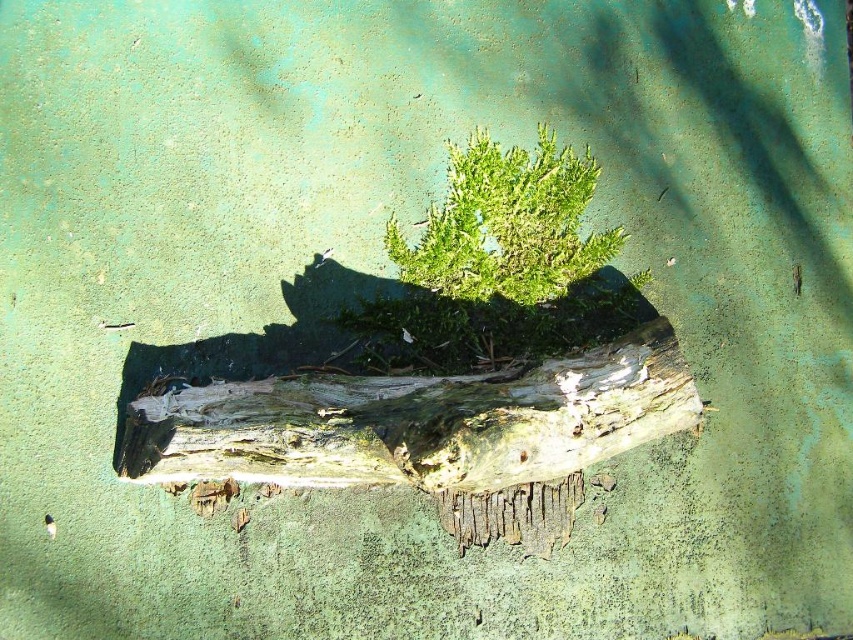
Question: Does weathered wood log at center appear over green fuzzy fern at center?

Choices:
 (A) yes
 (B) no

Answer: (B)

Question: Does weathered wood log at center have a lesser width compared to green fuzzy fern at center?

Choices:
 (A) no
 (B) yes

Answer: (A)

Question: Does weathered wood log at center appear on the left side of green fuzzy fern at center?

Choices:
 (A) yes
 (B) no

Answer: (A)